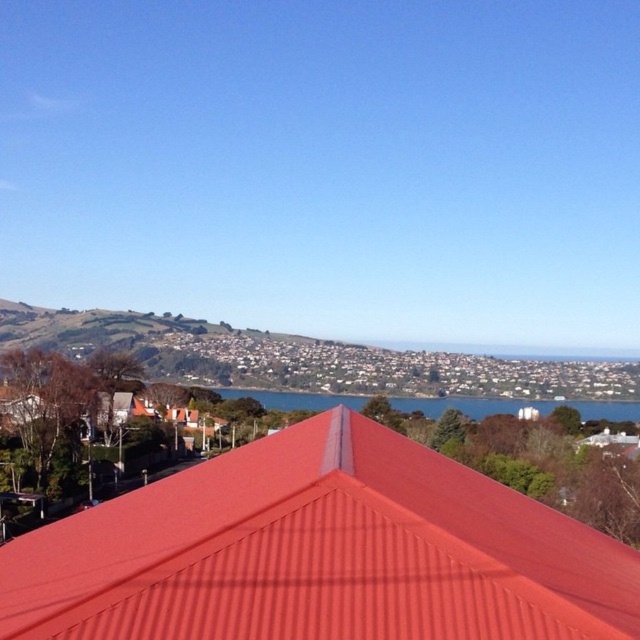
Can you confirm if metallic red roof at center is positioned to the right of blue water at center?

No, metallic red roof at center is not to the right of blue water at center.

The height and width of the screenshot is (640, 640). Find the location of `metallic red roof at center`. metallic red roof at center is located at coordinates (321, 552).

Find the location of `metallic red roof at center`. metallic red roof at center is located at coordinates (321, 552).